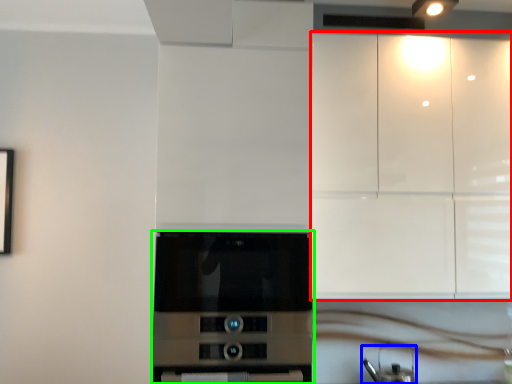
Question: Considering the real-world distances, which object is closest to cabinetry (highlighted by a red box)? appliance (highlighted by a blue box) or home appliance (highlighted by a green box).

Choices:
 (A) appliance
 (B) home appliance

Answer: (B)